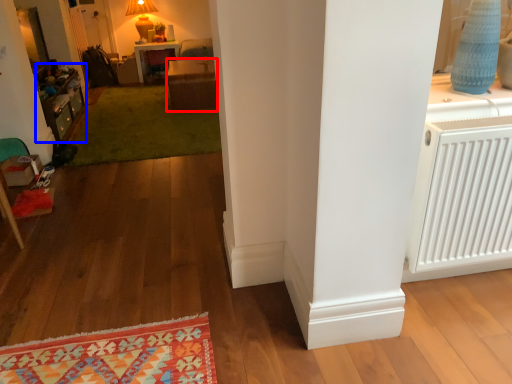
Question: Which of the following is the farthest to the observer, table (highlighted by a red box) or dresser (highlighted by a blue box)?

Choices:
 (A) table
 (B) dresser

Answer: (A)